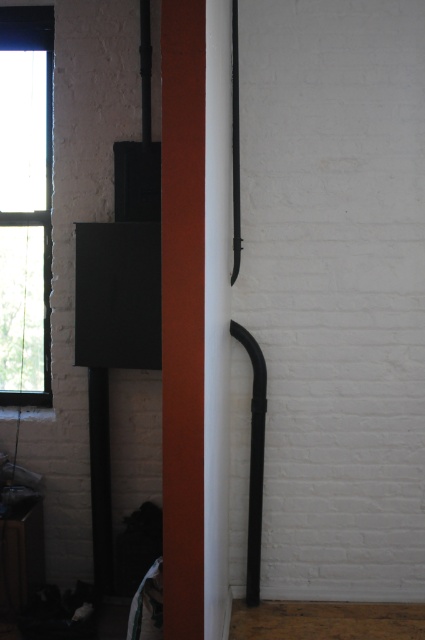
What do you see at coordinates (25, 204) in the screenshot? I see `clear glass window at left` at bounding box center [25, 204].

Between point (23, 42) and point (257, 470), which one is positioned behind?

The point (23, 42) is behind.

At what (x,y) coordinates should I click in order to perform the action: click on clear glass window at left. Please return your answer as a coordinate pair (x, y). This screenshot has width=425, height=640. Looking at the image, I should click on (25, 204).

Between matte wood pillar at center and black matte pipe at center, which one is positioned lower?

black matte pipe at center is lower down.

Looking at this image, can you confirm if matte wood pillar at center is wider than black matte pipe at center?

No.

Between point (203, 35) and point (248, 340), which one is positioned in front?

Point (203, 35) is more forward.

The image size is (425, 640). Find the location of `matte wood pillar at center`. matte wood pillar at center is located at coordinates (183, 314).

Looking at this image, who is more distant from viewer, (175,74) or (3,202)?

The point (3,202) is behind.

Does point (172, 244) come closer to viewer compared to point (11, 54)?

Yes.

At what (x,y) coordinates should I click in order to perform the action: click on matte wood pillar at center. Please return your answer as a coordinate pair (x, y). This screenshot has width=425, height=640. Looking at the image, I should click on (183, 314).